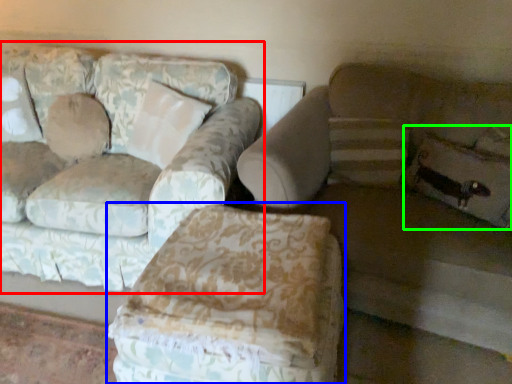
Question: Which object is the closest to the studio couch (highlighted by a red box)? Choose among these: swivel chair (highlighted by a blue box) or pillow (highlighted by a green box).

Choices:
 (A) swivel chair
 (B) pillow

Answer: (A)